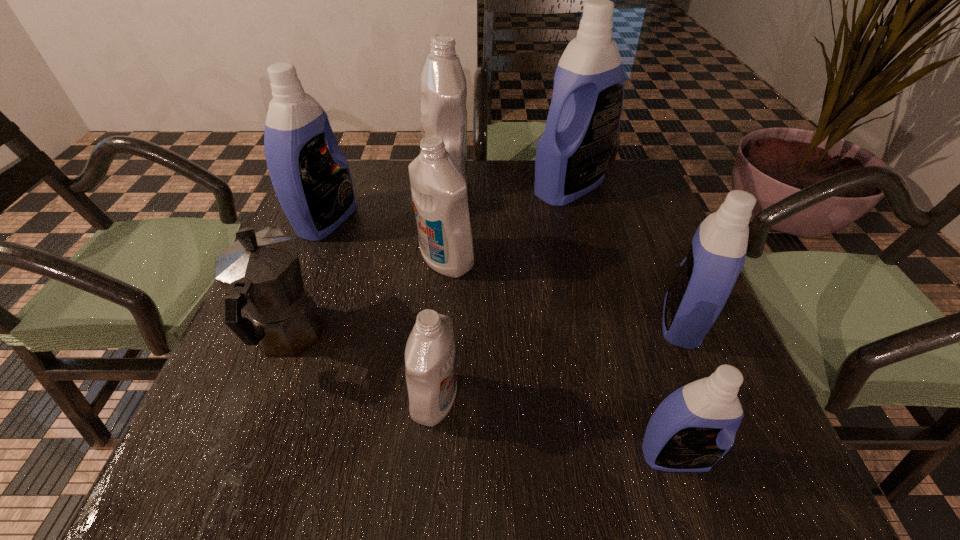
The image size is (960, 540). In order to click on vacant position in the image that satisfies the following two spatial constraints: 1. on the front side of the farthest white detergent; 2. on the left side of the biggest blue detergent in this screenshot , I will do `click(445, 187)`.

This screenshot has width=960, height=540. Identify the location of free space that satisfies the following two spatial constraints: 1. on the front side of the smallest white detergent; 2. on the right side of the farthest white detergent. (424, 400).

You are a GUI agent. You are given a task and a screenshot of the screen. Output one action in this format:
    pyautogui.click(x=<x>, y=<y>)
    Task: Click on the blank space that satisfies the following two spatial constraints: 1. on the front side of the second biggest white detergent; 2. on the right side of the third biggest blue detergent
    The height and width of the screenshot is (540, 960).
    Given the screenshot: What is the action you would take?
    pyautogui.click(x=441, y=322)

Where is `vacant region that satisfies the following two spatial constraints: 1. on the back side of the tallest detergent; 2. on the left side of the second smallest white detergent`? vacant region that satisfies the following two spatial constraints: 1. on the back side of the tallest detergent; 2. on the left side of the second smallest white detergent is located at coordinates (452, 187).

At what (x,y) coordinates should I click in order to perform the action: click on free space that satisfies the following two spatial constraints: 1. on the pouring side of the second nearest white detergent; 2. on the right side of the coffeepot. Please return your answer as a coordinate pair (x, y). The width and height of the screenshot is (960, 540). Looking at the image, I should click on 318,260.